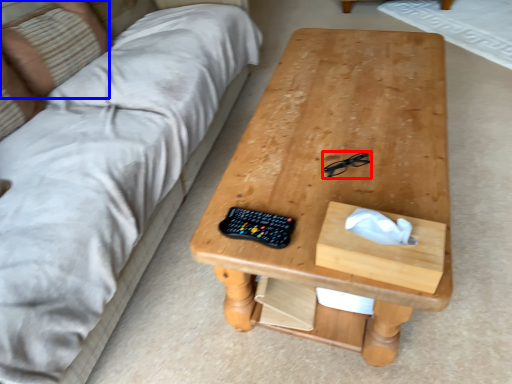
Question: Which of the following is the closest to the observer, glasses (highlighted by a red box) or pillow (highlighted by a blue box)?

Choices:
 (A) glasses
 (B) pillow

Answer: (A)